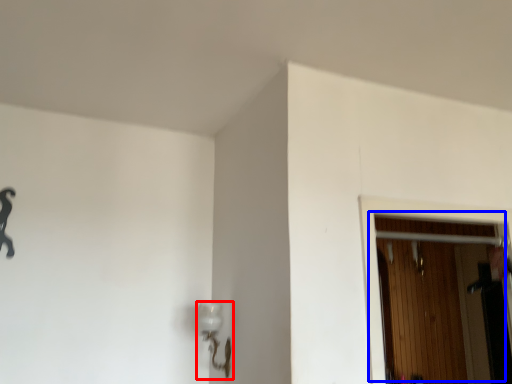
Question: Which object is closer to the camera taking this photo, lamp (highlighted by a red box) or door (highlighted by a blue box)?

Choices:
 (A) lamp
 (B) door

Answer: (B)